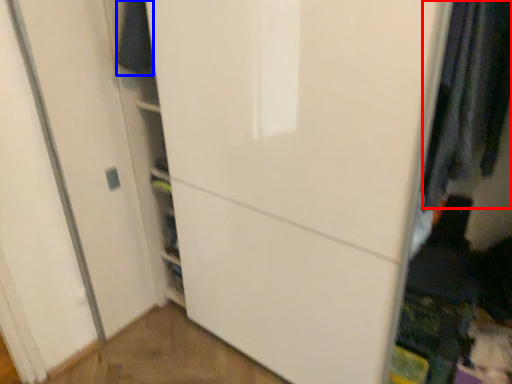
Question: Which of the following is the closest to the observer, clothing (highlighted by a red box) or clothing (highlighted by a blue box)?

Choices:
 (A) clothing
 (B) clothing

Answer: (A)